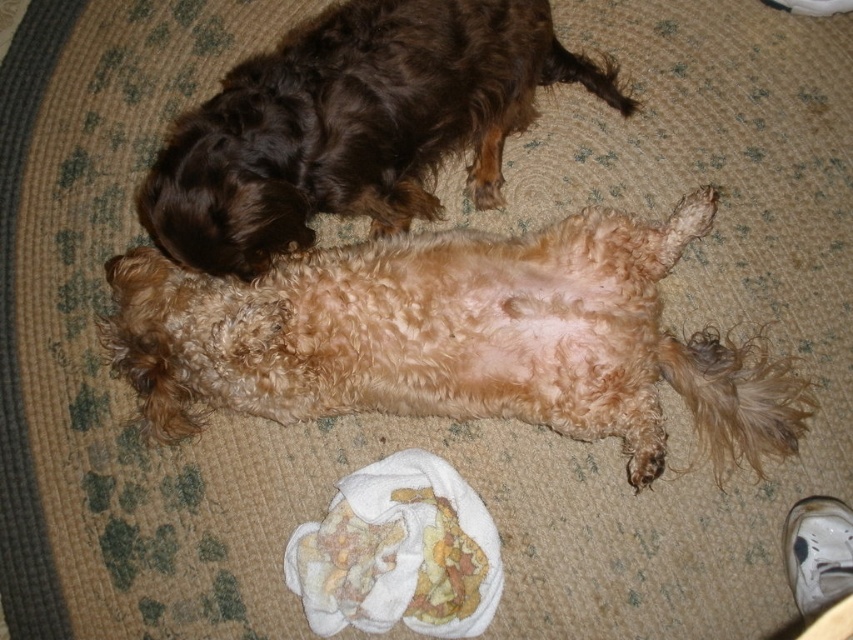
At what (x,y) coordinates should I click in order to perform the action: click on shiny brown fur at upper left. Please return your answer as a coordinate pair (x, y). Image resolution: width=853 pixels, height=640 pixels. Looking at the image, I should click on (354, 125).

Which is more to the left, shiny brown fur at upper left or printed fabric cloth at lower center?

printed fabric cloth at lower center is more to the left.

Where is `shiny brown fur at upper left`? The height and width of the screenshot is (640, 853). shiny brown fur at upper left is located at coordinates (354, 125).

At what (x,y) coordinates should I click in order to perform the action: click on shiny brown fur at upper left. Please return your answer as a coordinate pair (x, y). Looking at the image, I should click on (354, 125).

Which is more to the right, fuzzy light brown dog at center or printed fabric cloth at lower center?

Positioned to the right is fuzzy light brown dog at center.

Can you confirm if fuzzy light brown dog at center is positioned to the right of printed fabric cloth at lower center?

Yes, fuzzy light brown dog at center is to the right of printed fabric cloth at lower center.

Is point (244, 358) less distant than point (386, 536)?

Yes, point (244, 358) is closer to viewer.

Image resolution: width=853 pixels, height=640 pixels. Find the location of `fuzzy light brown dog at center`. fuzzy light brown dog at center is located at coordinates (456, 339).

Is fuzzy light brown dog at center further to the viewer compared to shiny brown fur at upper left?

Yes, it is behind shiny brown fur at upper left.

In the scene shown: Between fuzzy light brown dog at center and shiny brown fur at upper left, which one is positioned higher?

Positioned higher is shiny brown fur at upper left.

Find the location of `fuzzy light brown dog at center`. fuzzy light brown dog at center is located at coordinates (456, 339).